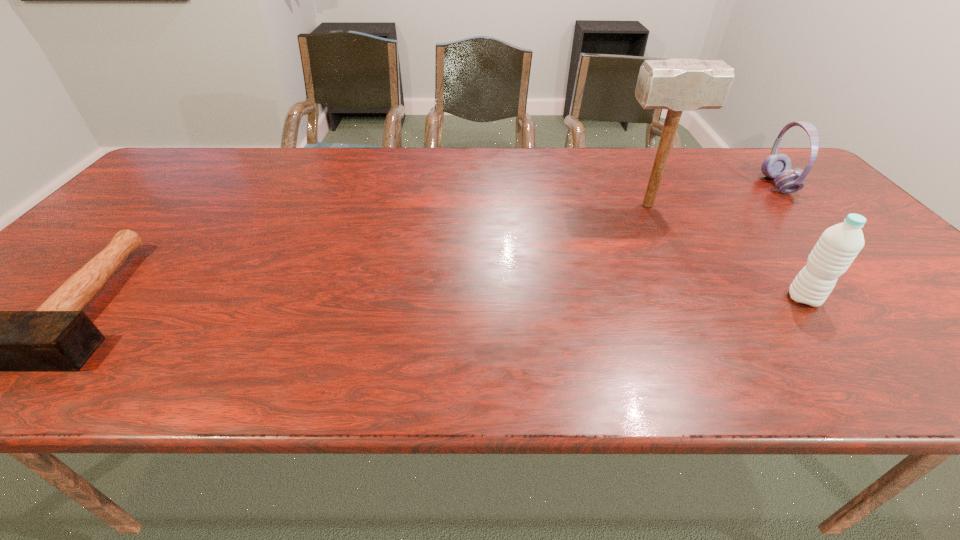
Image resolution: width=960 pixels, height=540 pixels. In order to click on free region located 0.160m on the headband and ear cups of the headset in this screenshot , I will do `click(710, 185)`.

Where is `object that is at the far edge`? The height and width of the screenshot is (540, 960). object that is at the far edge is located at coordinates (777, 166).

I want to click on object present at the right edge, so click(777, 166).

What are the coordinates of `object situated at the far right corner` in the screenshot? It's located at (777, 166).

Where is `free space at the far edge of the desktop`? The height and width of the screenshot is (540, 960). free space at the far edge of the desktop is located at coordinates (464, 183).

Where is `vacant space at the near edge of the desktop`? vacant space at the near edge of the desktop is located at coordinates (747, 360).

Locate an element on the screen. vacant space at the far left corner is located at coordinates (199, 169).

Find the location of a particular element. This screenshot has height=540, width=960. free space between the rightmost object and the taller mallet is located at coordinates (712, 195).

This screenshot has height=540, width=960. I want to click on free space that is in between the third object from right to left and the rightmost object, so click(x=712, y=195).

At what (x,y) coordinates should I click in order to perform the action: click on vacant space that's between the third object from left to right and the third object from right to left. Please return your answer as a coordinate pair (x, y). Image resolution: width=960 pixels, height=540 pixels. Looking at the image, I should click on (726, 252).